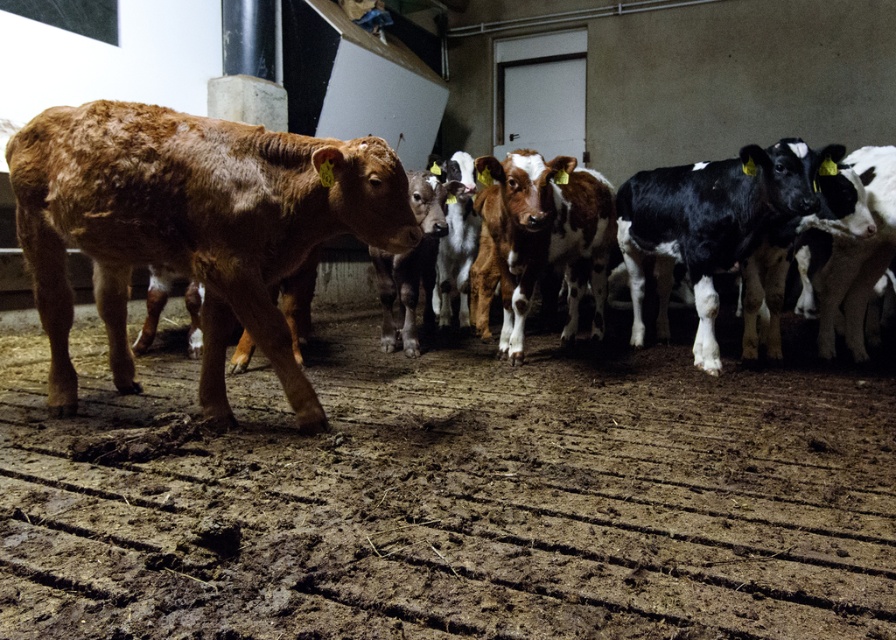
You are a farmer checking the barn and notice the brown smooth calf at left and the brown textured dirt track at center. Which direction should you walk to reach the dirt track from the calf?

The brown textured dirt track at center is to the right of the brown smooth calf at left, so you should walk to the right to reach the dirt track from the calf.

In the scene shown: You are a farmer checking the calves in the barn. You see the brown smooth calf at left and the brown furry calf at left. Which calf is positioned closer to the right side of the barn?

The brown smooth calf at left is positioned to the right of the brown furry calf at left, so it is closer to the right side of the barn.